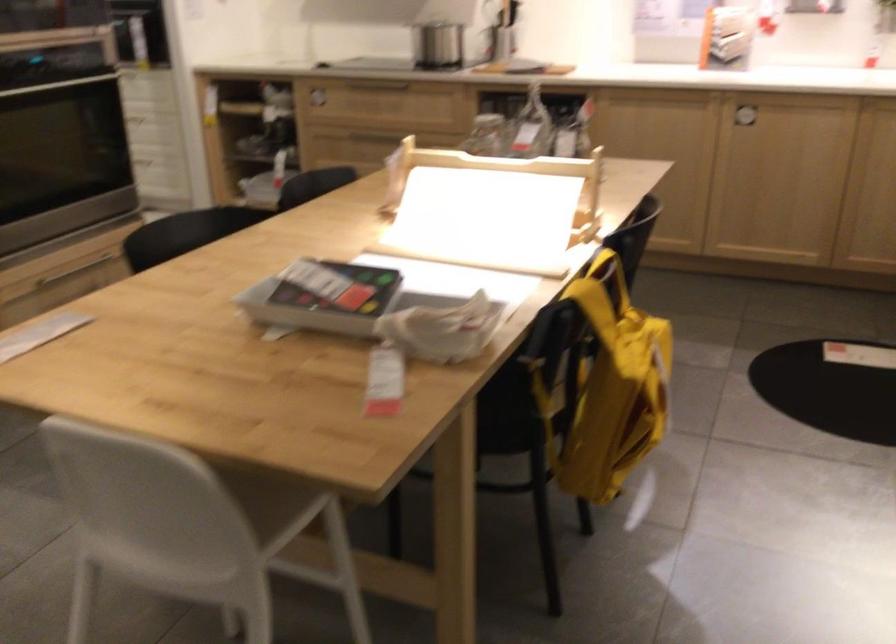
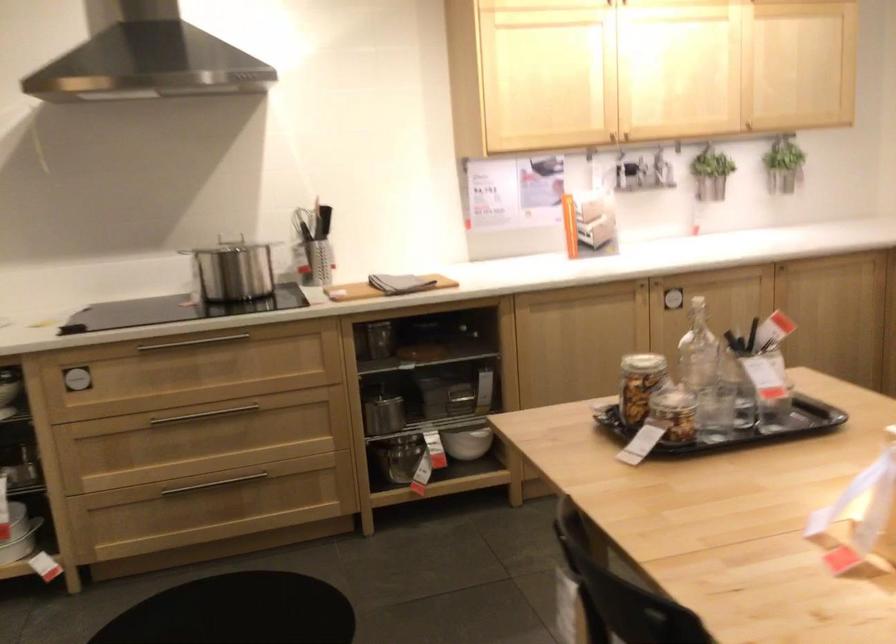
The point at (476, 151) is marked in the first image. Where is the corresponding point in the second image?

(673, 413)